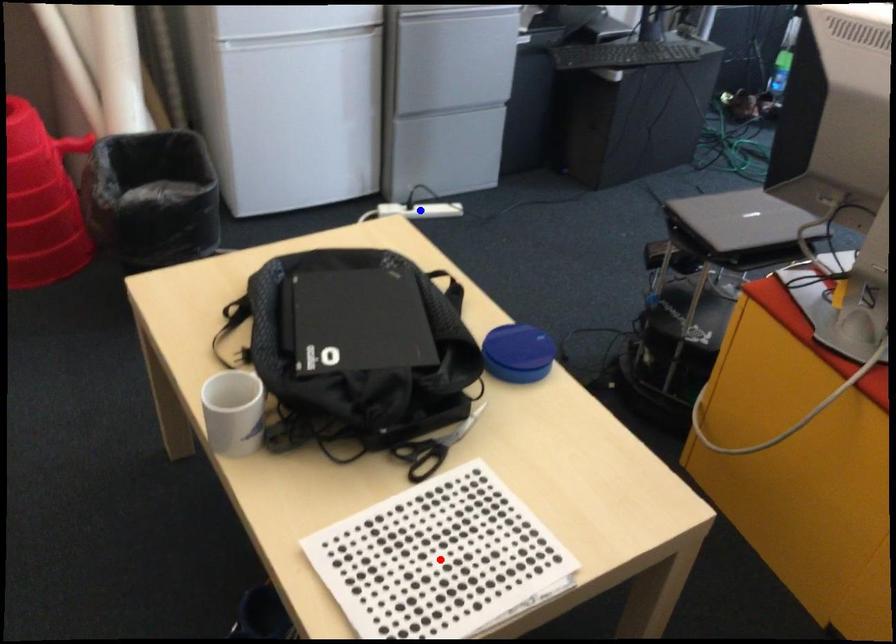
Question: Two points are marked on the image. Which point is closer to the camera?

Choices:
 (A) Blue point is closer.
 (B) Red point is closer.

Answer: (B)